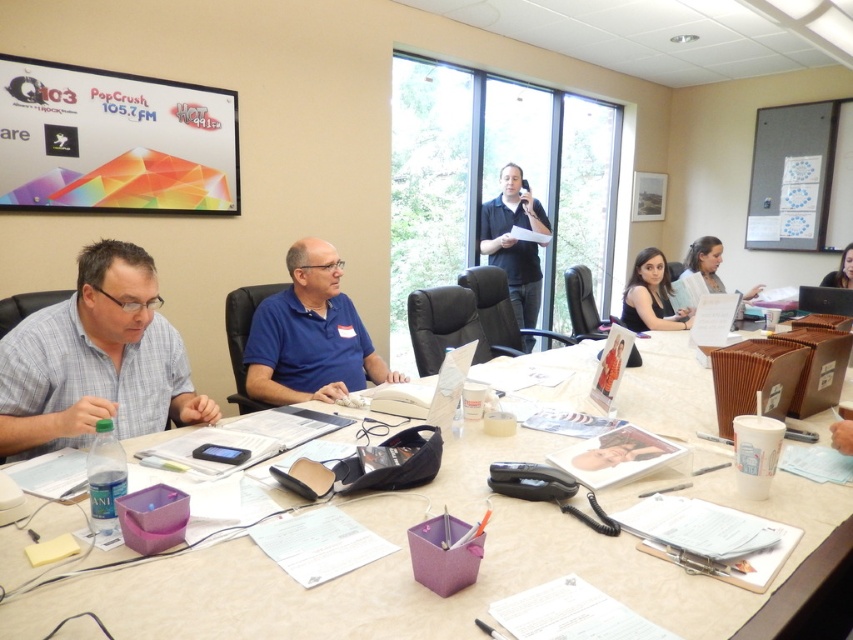
You are a photographer taking a photo of the meeting room scene. You want to ensure that both the gray checkered shirt at left and the blue cotton shirt at center are clearly visible in your shot. Which shirt should you focus on to make sure both are in focus?

The gray checkered shirt at left is in front of the blue cotton shirt at center, so focusing on the gray checkered shirt at left will ensure both are in focus as it is closer to the camera.

You are a photographer standing in the meeting room and want to take a photo of the black fabric shirt at center and the smooth skin face at upper right. Which object will appear larger in the photo?

The black fabric shirt at center will appear larger in the photo because it is closer to the viewer than the smooth skin face at upper right.

From the picture: You are a photographer in the room and want to take a photo of both the black fabric shirt at center and the smooth skin face at upper right. To ensure both are in frame, should you adjust your camera to focus more to the left or the right?

The black fabric shirt at center is positioned on the left side of smooth skin face at upper right, so you should focus more to the left to include both in the frame.